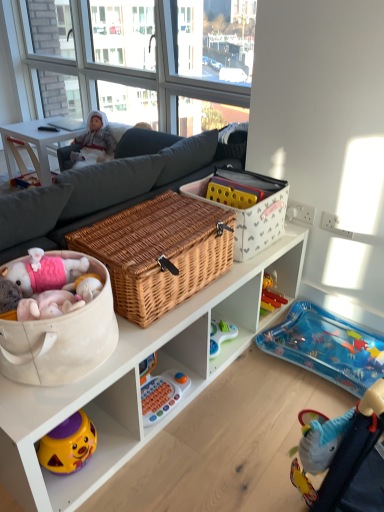
Where is `vacant space to the right of orange plastic toy at center`? vacant space to the right of orange plastic toy at center is located at coordinates (203, 404).